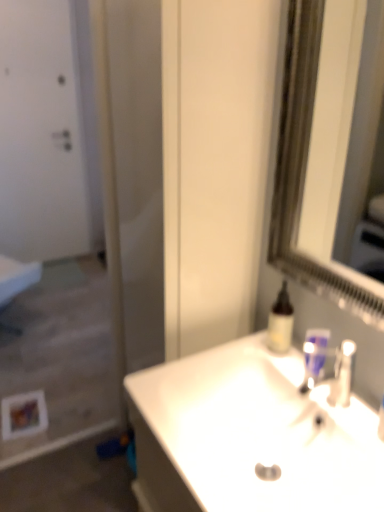
Identify the location of vacant area that lies in front of blue plastic mouthwash at sink, the first mouthwash viewed from the right. The image size is (384, 512). (337, 407).